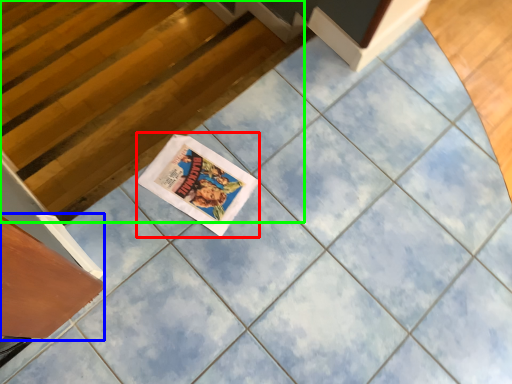
Question: Estimate the real-world distances between objects in this image. Which object is farther from comic book (highlighted by a red box), drawer (highlighted by a blue box) or stairwell (highlighted by a green box)?

Choices:
 (A) drawer
 (B) stairwell

Answer: (B)